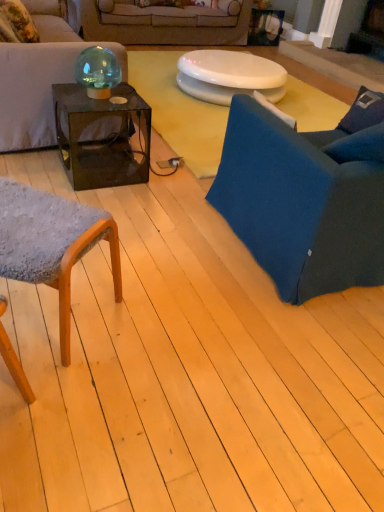
Where is `vacant area that is in front of textured gray fabric chair at lower left, which is the 1th chair from left to right`? The height and width of the screenshot is (512, 384). vacant area that is in front of textured gray fabric chair at lower left, which is the 1th chair from left to right is located at coordinates (x=55, y=420).